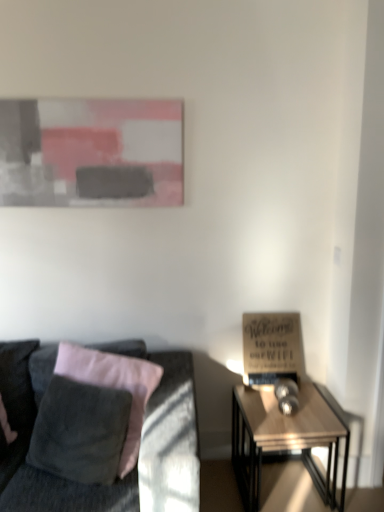
Question: In terms of height, does wooden sign at right look taller or shorter compared to velvet gray couch at left?

Choices:
 (A) tall
 (B) short

Answer: (B)

Question: From the image's perspective, relative to velvet gray couch at left, is wooden sign at right above or below?

Choices:
 (A) above
 (B) below

Answer: (A)

Question: Which of these objects is positioned farthest from the wooden glossy table at right?

Choices:
 (A) matte gray painting at upper center
 (B) wooden sign at right
 (C) velvet gray couch at left

Answer: (A)

Question: Which object is positioned farthest from the velvet gray couch at left?

Choices:
 (A) matte gray painting at upper center
 (B) wooden glossy table at right
 (C) wooden sign at right

Answer: (A)